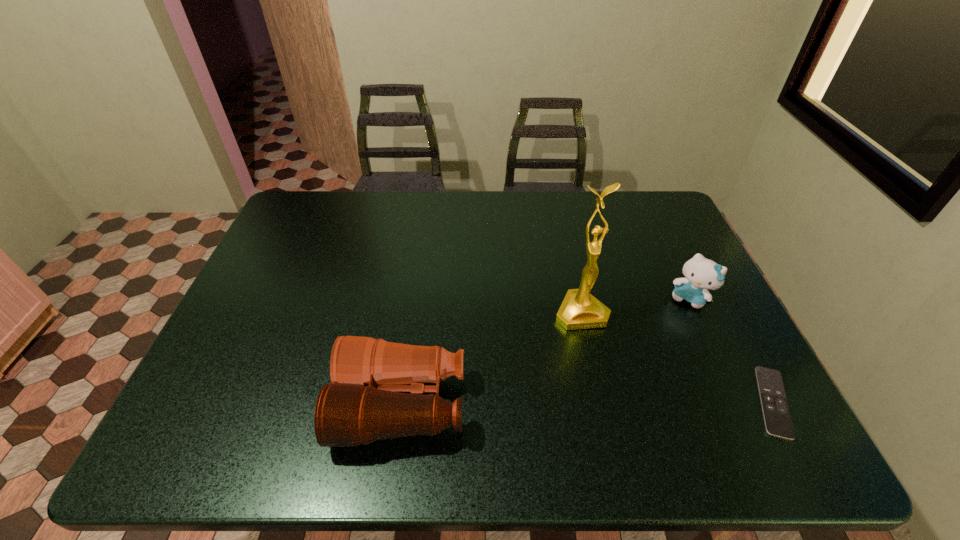
Locate an element on the screen. This screenshot has height=540, width=960. vacant spot on the desktop that is between the binoculars and the shortest object and is positioned on the front-facing side of the award is located at coordinates (621, 403).

Find the location of a particular element. This screenshot has width=960, height=540. vacant space on the desktop that is between the leftmost object and the remote control and is positioned on the face of the kitten is located at coordinates 630,403.